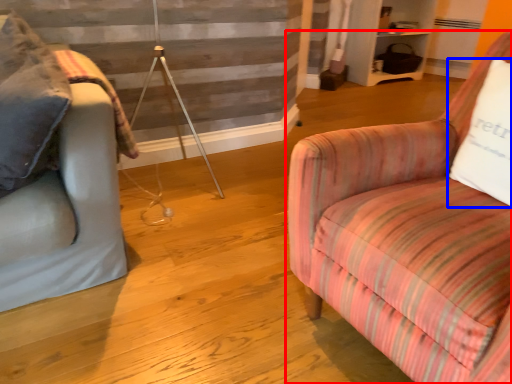
Question: Which point is further to the camera, chair (highlighted by a red box) or pillow (highlighted by a blue box)?

Choices:
 (A) chair
 (B) pillow

Answer: (B)